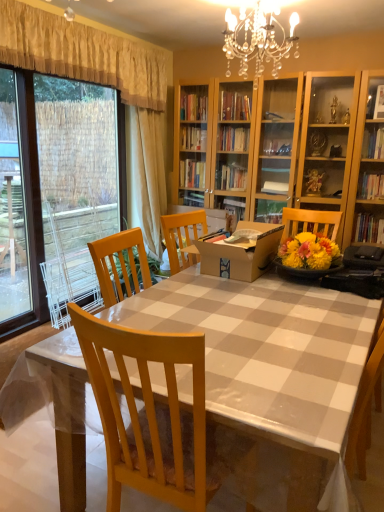
Question: From the image's perspective, is white glossy table at center positioned above or below transparent glass door at left?

Choices:
 (A) below
 (B) above

Answer: (A)

Question: From a real-world perspective, is white glossy table at center positioned above or below transparent glass door at left?

Choices:
 (A) below
 (B) above

Answer: (A)

Question: Which object is the closest to the beige fabric curtain at upper left, which ranks as the 2th curtain in front-to-back order?

Choices:
 (A) yellow textured curtain at upper left, marked as the first curtain in a front-to-back arrangement
 (B) white glossy table at center
 (C) transparent glass door at left

Answer: (C)

Question: Which object is positioned closest to the transparent glass door at left?

Choices:
 (A) white glossy table at center
 (B) yellow textured curtain at upper left, marked as the second curtain in a back-to-front arrangement
 (C) beige fabric curtain at upper left, which ranks as the 2th curtain in front-to-back order

Answer: (C)